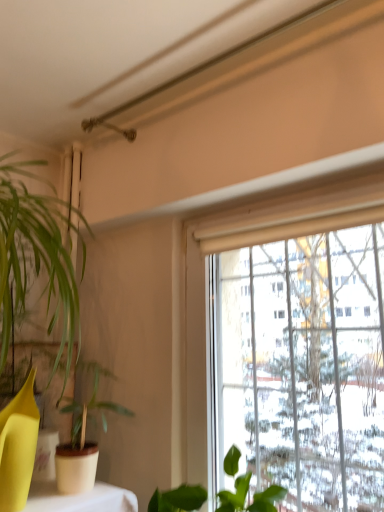
Question: In the image, is green matte plant at left, the second houseplant in the right-to-left sequence, positioned in front of or behind green matte leafy plant at lower center, arranged as the 2th houseplant when viewed from the left?

Choices:
 (A) behind
 (B) front

Answer: (A)

Question: In terms of width, does green matte plant at left, the 1th houseplant positioned from the left, look wider or thinner when compared to green matte leafy plant at lower center, arranged as the 2th houseplant when viewed from the left?

Choices:
 (A) wide
 (B) thin

Answer: (B)

Question: Is point (x=94, y=397) closer or farther from the camera than point (x=183, y=509)?

Choices:
 (A) farther
 (B) closer

Answer: (A)

Question: Is green matte leafy plant at lower center, the first houseplant in the right-to-left sequence, taller or shorter than green matte plant at left, the second houseplant in the right-to-left sequence?

Choices:
 (A) tall
 (B) short

Answer: (B)

Question: Based on their positions, is green matte leafy plant at lower center, arranged as the 2th houseplant when viewed from the left, located to the left or right of green matte plant at left, the 1th houseplant positioned from the left?

Choices:
 (A) right
 (B) left

Answer: (A)

Question: In terms of size, does green matte leafy plant at lower center, the first houseplant in the right-to-left sequence, appear bigger or smaller than green matte plant at left, the second houseplant in the right-to-left sequence?

Choices:
 (A) big
 (B) small

Answer: (A)

Question: From the image's perspective, is green matte leafy plant at lower center, the first houseplant in the right-to-left sequence, located above or below green matte plant at left, the second houseplant in the right-to-left sequence?

Choices:
 (A) above
 (B) below

Answer: (B)